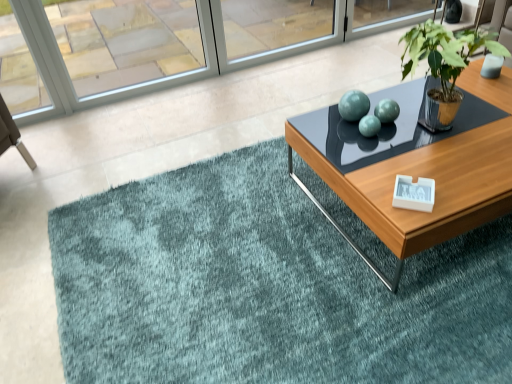
Image resolution: width=512 pixels, height=384 pixels. What are the coordinates of `wooden glossy coffee table at center` in the screenshot? It's located at point(425,176).

This screenshot has width=512, height=384. In order to click on teal plush rug at center in this screenshot , I will do `click(265, 288)`.

What are the coordinates of `clear glass window at upper left` in the screenshot? It's located at (132, 43).

Between wooden glossy coffee table at center and green metallic plant pot at upper right, which one has smaller width?

With smaller width is green metallic plant pot at upper right.

Does point (383, 183) come closer to viewer compared to point (447, 52)?

No.

Is wooden glossy coffee table at center looking in the opposite direction of green metallic plant pot at upper right?

No, wooden glossy coffee table at center is not facing away from green metallic plant pot at upper right.

From a real-world perspective, which is physically above, wooden glossy coffee table at center or green metallic plant pot at upper right?

green metallic plant pot at upper right is physically above.

Find the location of `window that appears above the teal plush rug at center (from the image's perspective)`. window that appears above the teal plush rug at center (from the image's perspective) is located at coordinates (132, 43).

Considering the relative positions of teal plush rug at center and clear glass window at upper left in the image provided, is teal plush rug at center behind clear glass window at upper left?

No, it is not.

Can you confirm if teal plush rug at center is wider than clear glass window at upper left?

Yes.

Is teal plush rug at center situated inside clear glass window at upper left or outside?

teal plush rug at center is not inside clear glass window at upper left, it's outside.

Who is smaller, clear glass window at upper left or green metallic plant pot at upper right?

With smaller size is green metallic plant pot at upper right.

From a real-world perspective, is clear glass window at upper left on top of green metallic plant pot at upper right?

No.

Is clear glass window at upper left inside or outside of green metallic plant pot at upper right?

The correct answer is: outside.

From the image's perspective, which object appears higher, clear glass window at upper left or green metallic plant pot at upper right?

clear glass window at upper left appears higher in the image.

Is clear glass window at upper left thinner than wooden glossy coffee table at center?

Indeed, clear glass window at upper left has a lesser width compared to wooden glossy coffee table at center.

Based on the photo, is clear glass window at upper left turned away from wooden glossy coffee table at center?

No, wooden glossy coffee table at center is not at the back of clear glass window at upper left.

In the image, is clear glass window at upper left on the left side or the right side of wooden glossy coffee table at center?

From the image, it's evident that clear glass window at upper left is to the left of wooden glossy coffee table at center.

Can you confirm if wooden glossy coffee table at center is positioned to the right of clear glass window at upper left?

Correct, you'll find wooden glossy coffee table at center to the right of clear glass window at upper left.

Which is closer, (435, 222) or (147, 87)?

Point (435, 222) appears to be closer to the viewer than point (147, 87).

Is wooden glossy coffee table at center in front of or behind clear glass window at upper left in the image?

Clearly, wooden glossy coffee table at center is in front of clear glass window at upper left.

Considering the relative positions of green metallic plant pot at upper right and teal plush rug at center in the image provided, is green metallic plant pot at upper right to the left or to the right of teal plush rug at center?

In the image, green metallic plant pot at upper right appears on the right side of teal plush rug at center.

Considering the points (433, 36) and (223, 295), which point is in front, point (433, 36) or point (223, 295)?

Point (433, 36)

From a real-world perspective, is green metallic plant pot at upper right on teal plush rug at center?

Yes, from a real-world perspective, green metallic plant pot at upper right is over teal plush rug at center

Can you confirm if green metallic plant pot at upper right is wider than teal plush rug at center?

No, green metallic plant pot at upper right is not wider than teal plush rug at center.

Identify the location of doormat below the wooden glossy coffee table at center (from a real-world perspective). This screenshot has width=512, height=384. (265, 288).

In the scene shown: Would you say teal plush rug at center is to the left or to the right of wooden glossy coffee table at center in the picture?

Clearly, teal plush rug at center is on the left of wooden glossy coffee table at center in the image.

Considering the relative positions of teal plush rug at center and wooden glossy coffee table at center in the image provided, is teal plush rug at center in front of wooden glossy coffee table at center?

That is True.

Is point (481, 300) positioned after point (312, 122)?

No, (481, 300) is closer to viewer.

This screenshot has width=512, height=384. Identify the location of coffee table on the right of green metallic plant pot at upper right. (425, 176).

At what (x,y) coordinates should I click in order to perform the action: click on doormat below the clear glass window at upper left (from a real-world perspective). Please return your answer as a coordinate pair (x, y). Image resolution: width=512 pixels, height=384 pixels. Looking at the image, I should click on (265, 288).

Considering their positions, is wooden glossy coffee table at center positioned further to clear glass window at upper left than green metallic plant pot at upper right?

green metallic plant pot at upper right.

Looking at the image, which one is located further to green metallic plant pot at upper right, clear glass window at upper left or teal plush rug at center?

clear glass window at upper left is further to green metallic plant pot at upper right.

Looking at the image, which one is located closer to wooden glossy coffee table at center, teal plush rug at center or green metallic plant pot at upper right?

green metallic plant pot at upper right lies closer to wooden glossy coffee table at center than the other object.

When comparing their distances from green metallic plant pot at upper right, does clear glass window at upper left or wooden glossy coffee table at center seem closer?

The object closer to green metallic plant pot at upper right is wooden glossy coffee table at center.

From the image, which object appears to be nearer to teal plush rug at center, wooden glossy coffee table at center or clear glass window at upper left?

wooden glossy coffee table at center.

Which object lies further to the anchor point clear glass window at upper left, teal plush rug at center or wooden glossy coffee table at center?

Among the two, teal plush rug at center is located further to clear glass window at upper left.

Considering their positions, is clear glass window at upper left positioned further to teal plush rug at center than wooden glossy coffee table at center?

Based on the image, clear glass window at upper left appears to be further to teal plush rug at center.

Estimate the real-world distances between objects in this image. Which object is closer to green metallic plant pot at upper right, wooden glossy coffee table at center or teal plush rug at center?

wooden glossy coffee table at center lies closer to green metallic plant pot at upper right than the other object.

The image size is (512, 384). I want to click on coffee table that lies between green metallic plant pot at upper right and teal plush rug at center from top to bottom, so click(425, 176).

Where is `doormat between clear glass window at upper left and wooden glossy coffee table at center in the horizontal direction`? doormat between clear glass window at upper left and wooden glossy coffee table at center in the horizontal direction is located at coordinates (265, 288).

At what (x,y) coordinates should I click in order to perform the action: click on doormat between clear glass window at upper left and green metallic plant pot at upper right in the horizontal direction. Please return your answer as a coordinate pair (x, y). The width and height of the screenshot is (512, 384). Looking at the image, I should click on (265, 288).

The width and height of the screenshot is (512, 384). Identify the location of houseplant situated between clear glass window at upper left and wooden glossy coffee table at center from left to right. (445, 60).